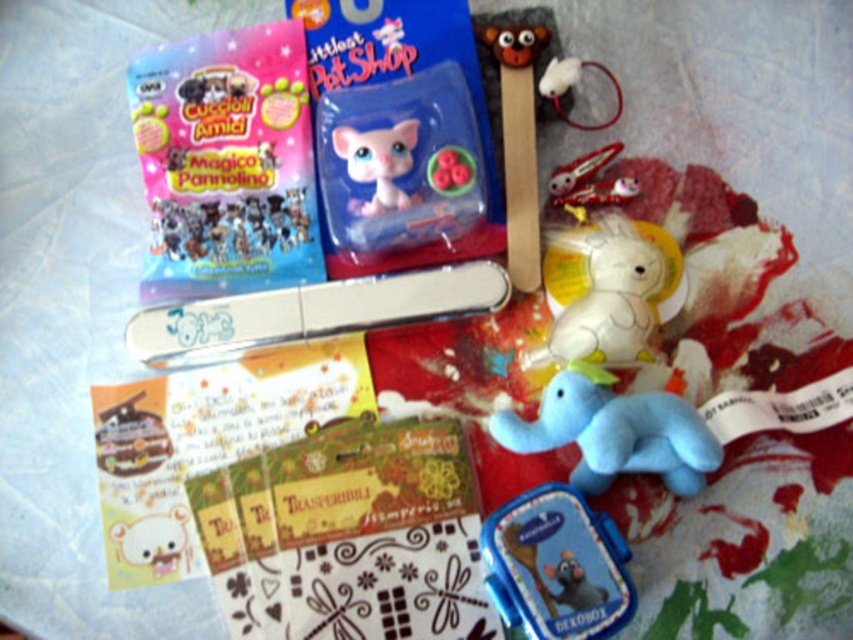
Question: Does white plush unicorn at upper center have a greater width compared to blue plush elephant at center?

Choices:
 (A) yes
 (B) no

Answer: (B)

Question: Considering the real-world distances, which object is farthest from the translucent plastic cat at center?

Choices:
 (A) metallic silver nail file at center
 (B) blue plastic lunchbox at lower center
 (C) blue plush elephant at center

Answer: (B)

Question: Is transperibile paper at center below white plush unicorn at upper center?

Choices:
 (A) no
 (B) yes

Answer: (B)

Question: Which of the following is the farthest from the observer?

Choices:
 (A) transperibile paper at center
 (B) blue plastic lunchbox at lower center

Answer: (A)

Question: Which point is farther from the camera taking this photo?

Choices:
 (A) (416, 316)
 (B) (184, 285)

Answer: (B)

Question: Does blue plastic lunchbox at lower center appear over metallic chocolate bar at lower left?

Choices:
 (A) no
 (B) yes

Answer: (A)